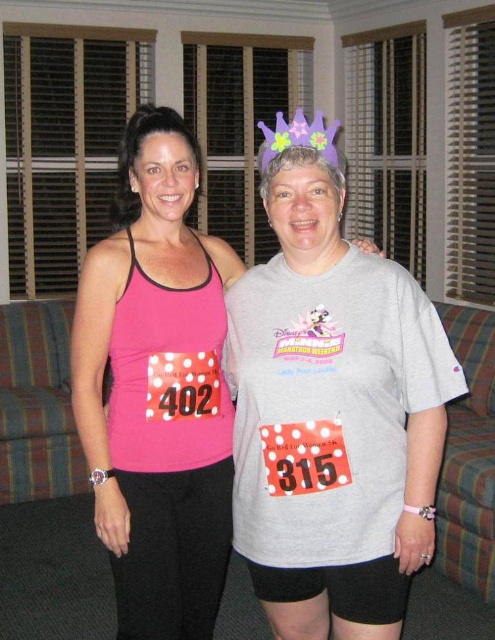
Question: Which point is farther to the camera?

Choices:
 (A) (209, 572)
 (B) (343, 611)

Answer: (A)

Question: Is matte gray t-shirt at center in front of pink matte tank top at center?

Choices:
 (A) yes
 (B) no

Answer: (A)

Question: Is matte gray t-shirt at center to the right of pink matte tank top at center from the viewer's perspective?

Choices:
 (A) yes
 (B) no

Answer: (A)

Question: Where is matte gray t-shirt at center located in relation to pink matte tank top at center in the image?

Choices:
 (A) below
 (B) above

Answer: (A)